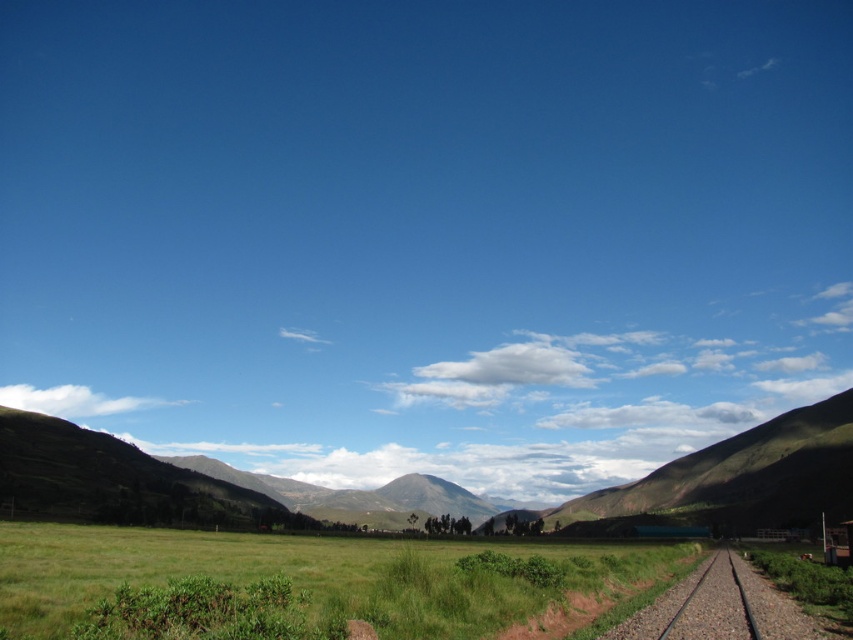
Consider the image. You are standing at the bottom right corner of the image and want to walk towards the green grassy field at lower center. Which direction should you head relative to the smooth metal train track at lower right?

The green grassy field at lower center is to the left of the smooth metal train track at lower right, so you should head towards the left side of the train track to reach it.